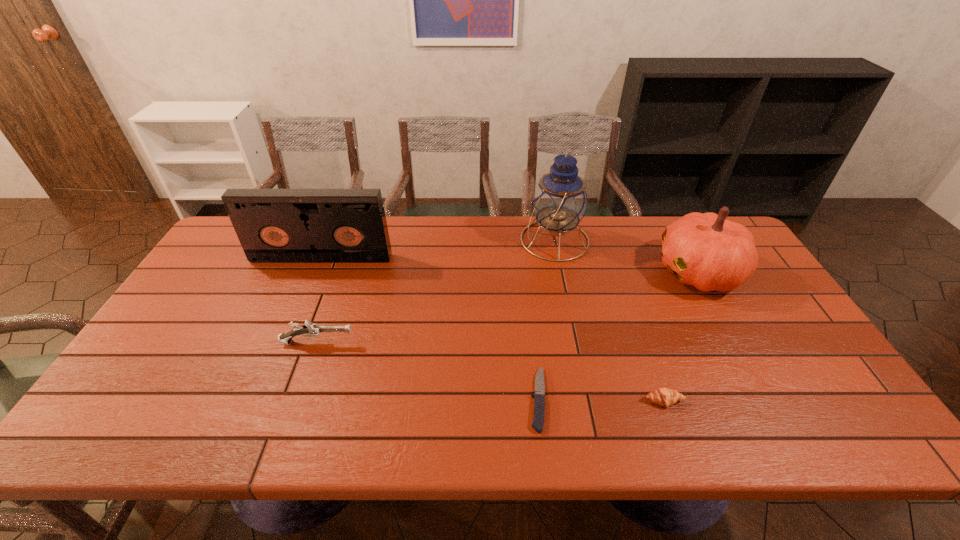
Locate an element on the screen. The image size is (960, 540). free space located on the front-facing side of the lantern is located at coordinates (434, 240).

You are a GUI agent. You are given a task and a screenshot of the screen. Output one action in this format:
    pyautogui.click(x=<x>, y=<y>)
    Task: Click on the free space located 0.160m on the front side of the videotape
    
    Given the screenshot: What is the action you would take?
    pyautogui.click(x=304, y=299)

At what (x,y) coordinates should I click in order to perform the action: click on vacant space located 0.380m on the front-facing side of the rightmost object. Please return your answer as a coordinate pair (x, y). The image size is (960, 540). Looking at the image, I should click on 533,272.

What are the coordinates of `vacant space located on the front-facing side of the rightmost object` in the screenshot? It's located at (565, 272).

Find the location of a particular element. The height and width of the screenshot is (540, 960). free space located on the front-facing side of the rightmost object is located at coordinates (636, 272).

This screenshot has width=960, height=540. Find the location of `vacant space located aimed along the barrel of the third shortest object`. vacant space located aimed along the barrel of the third shortest object is located at coordinates (407, 342).

Identify the location of vacant space situated 0.050m on the front-facing side of the second shortest object. This screenshot has width=960, height=540. (674, 430).

Identify the location of free spot located 0.050m on the back of the steak knife. This screenshot has height=540, width=960. (533, 352).

Locate an element on the screen. Image resolution: width=960 pixels, height=540 pixels. lantern that is positioned at the far edge is located at coordinates (560, 201).

Find the location of `videotape that is at the far edge`. videotape that is at the far edge is located at coordinates (273, 225).